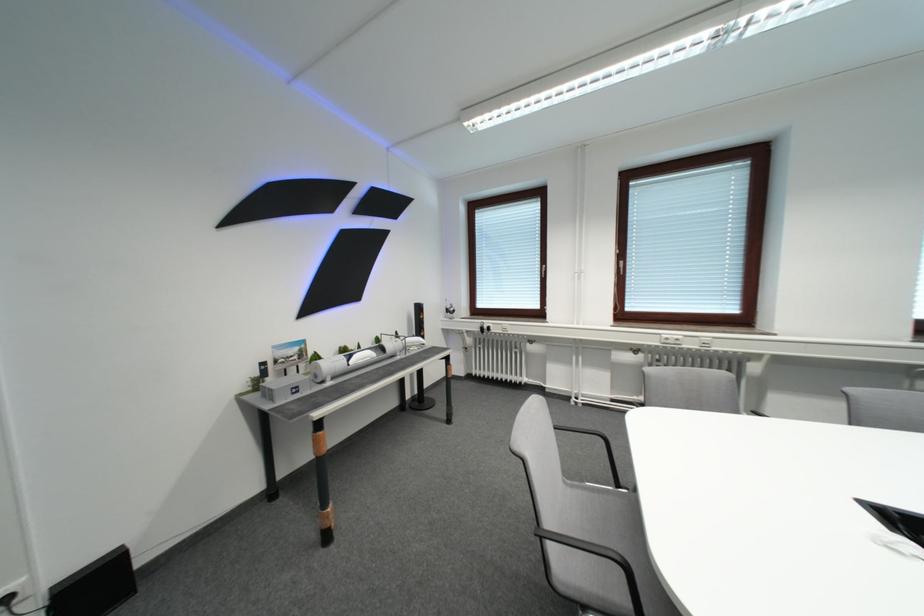
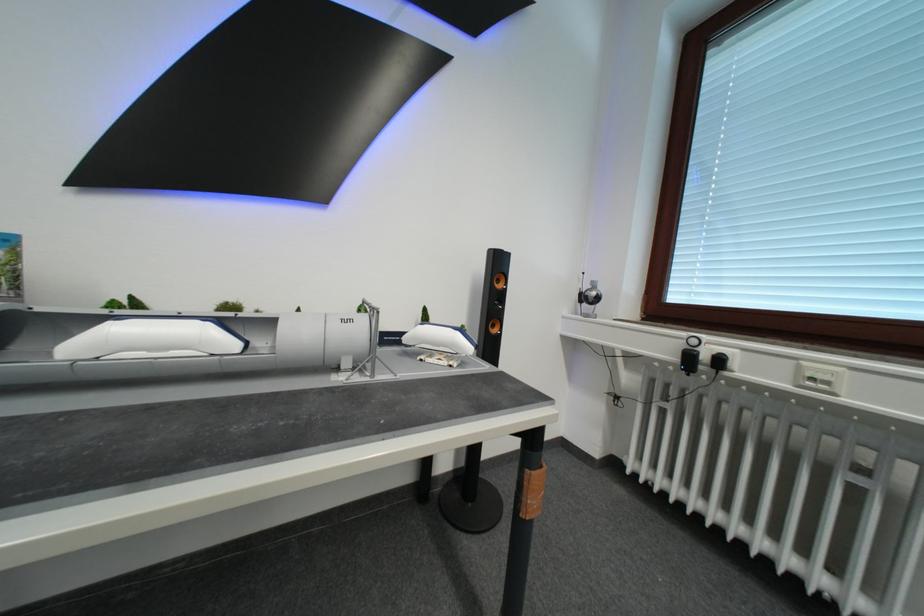
In the second image, find the point that corresponds to (457,314) in the first image.

(592, 301)